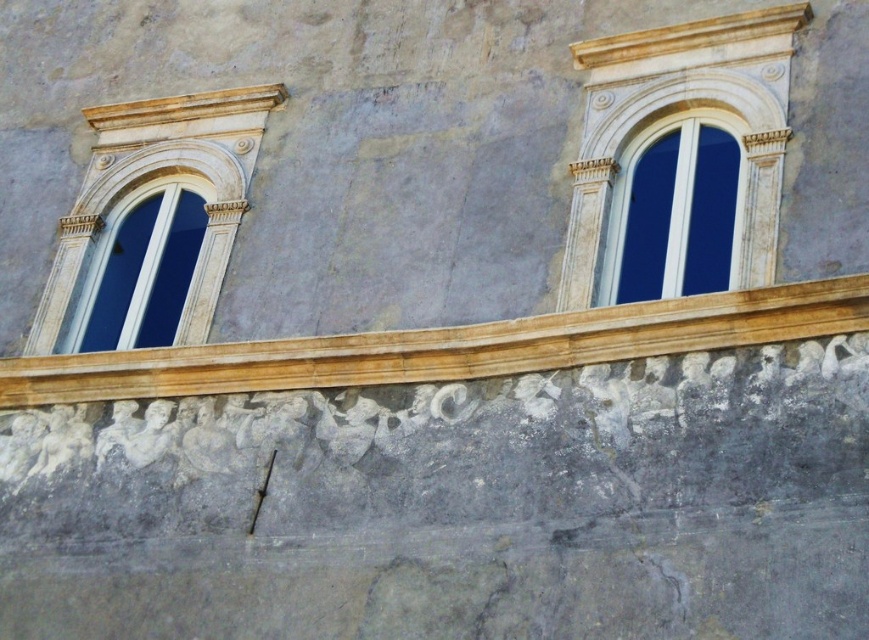
Is golden stone ledge at center to the right of white marble window at upper right from the viewer's perspective?

In fact, golden stone ledge at center is to the left of white marble window at upper right.

Is point (458, 337) closer to viewer compared to point (708, 240)?

Yes, it is.

Between point (571, 333) and point (730, 144), which one is positioned in front?

Positioned in front is point (571, 333).

At what (x,y) coordinates should I click in order to perform the action: click on golden stone ledge at center. Please return your answer as a coordinate pair (x, y). The width and height of the screenshot is (869, 640). Looking at the image, I should click on (446, 348).

Can you confirm if white marble window at upper right is shorter than matte white window at left?

Yes.

Who is more distant from viewer, (721, 138) or (123, 248)?

The point (123, 248) is behind.

Image resolution: width=869 pixels, height=640 pixels. What are the coordinates of `white marble window at upper right` in the screenshot? It's located at (673, 216).

Is golden stone ledge at center above matte white window at left?

Actually, golden stone ledge at center is below matte white window at left.

Is golden stone ledge at center positioned at the back of matte white window at left?

No.

Is point (667, 349) positioned before point (149, 211)?

That is True.

At what (x,y) coordinates should I click in order to perform the action: click on golden stone ledge at center. Please return your answer as a coordinate pair (x, y). The width and height of the screenshot is (869, 640). Looking at the image, I should click on (446, 348).